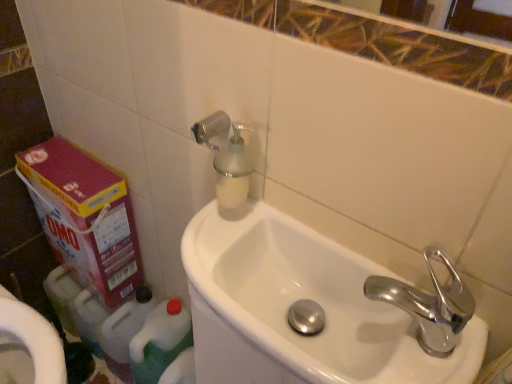
Question: Can you confirm if green plastic bottle at lower left, which ranks as the 2th cleaning product in right-to-left order, is smaller than silver metallic soap dispenser at upper center?

Choices:
 (A) no
 (B) yes

Answer: (A)

Question: From a real-world perspective, is green plastic bottle at lower left, which ranks as the 2th cleaning product in right-to-left order, physically below silver metallic soap dispenser at upper center?

Choices:
 (A) yes
 (B) no

Answer: (A)

Question: Does green plastic bottle at lower left, the first cleaning product positioned from the left, come behind silver metallic soap dispenser at upper center?

Choices:
 (A) no
 (B) yes

Answer: (B)

Question: From the image's perspective, does green plastic bottle at lower left, the first cleaning product positioned from the left, appear lower than silver metallic soap dispenser at upper center?

Choices:
 (A) no
 (B) yes

Answer: (B)

Question: Does green plastic bottle at lower left, the first cleaning product positioned from the left, contain silver metallic soap dispenser at upper center?

Choices:
 (A) yes
 (B) no

Answer: (B)

Question: From the image's perspective, relative to green plastic bottle at lower left, which ranks as the 1th cleaning product in right-to-left order, is pink cardboard box at lower left above or below?

Choices:
 (A) above
 (B) below

Answer: (A)

Question: Considering the positions of pink cardboard box at lower left and green plastic bottle at lower left, which ranks as the 1th cleaning product in right-to-left order, in the image, is pink cardboard box at lower left wider or thinner than green plastic bottle at lower left, which ranks as the 1th cleaning product in right-to-left order,?

Choices:
 (A) thin
 (B) wide

Answer: (A)

Question: Is point (96, 276) positioned closer to the camera than point (141, 334)?

Choices:
 (A) farther
 (B) closer

Answer: (A)

Question: Would you say pink cardboard box at lower left is inside or outside green plastic bottle at lower left, which ranks as the 1th cleaning product in right-to-left order?

Choices:
 (A) outside
 (B) inside

Answer: (A)

Question: In terms of size, does chrome metallic faucet at right appear bigger or smaller than green plastic bottle at lower left, which ranks as the 2th cleaning product in right-to-left order?

Choices:
 (A) small
 (B) big

Answer: (A)

Question: Considering the positions of point (440, 354) and point (129, 350), is point (440, 354) closer or farther from the camera than point (129, 350)?

Choices:
 (A) closer
 (B) farther

Answer: (A)

Question: Would you say chrome metallic faucet at right is inside or outside green plastic bottle at lower left, the first cleaning product positioned from the left?

Choices:
 (A) inside
 (B) outside

Answer: (B)

Question: In the image, is chrome metallic faucet at right on the left side or the right side of green plastic bottle at lower left, which ranks as the 2th cleaning product in right-to-left order?

Choices:
 (A) left
 (B) right

Answer: (B)

Question: Is pink cardboard box at lower left spatially inside silver metallic soap dispenser at upper center, or outside of it?

Choices:
 (A) inside
 (B) outside

Answer: (B)

Question: Is pink cardboard box at lower left wider or thinner than silver metallic soap dispenser at upper center?

Choices:
 (A) wide
 (B) thin

Answer: (A)